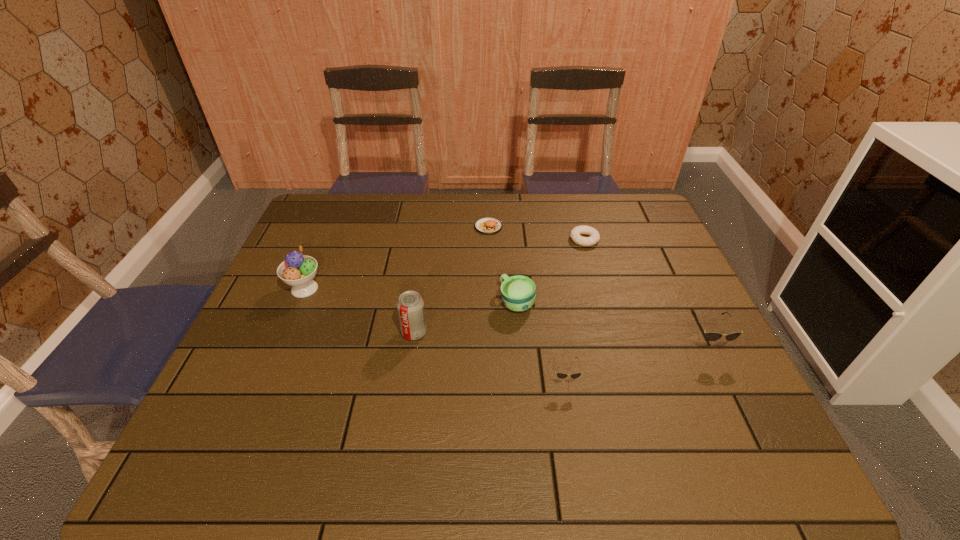
Find the location of a particular element. vacant space located 0.070m in front of the lenses of the shorter sunglasses is located at coordinates (571, 418).

You are a GUI agent. You are given a task and a screenshot of the screen. Output one action in this format:
    pyautogui.click(x=<x>, y=<y>)
    Task: Click on the free space located 0.170m in front of the lenses of the rightmost object
    The width and height of the screenshot is (960, 540).
    Given the screenshot: What is the action you would take?
    pyautogui.click(x=746, y=423)

The width and height of the screenshot is (960, 540). Identify the location of vacant space located on the front of the patty. (490, 279).

This screenshot has height=540, width=960. I want to click on vacant space located 0.070m on the left of the shortest object, so click(548, 239).

Locate an element on the screen. This screenshot has height=540, width=960. vacant space located on the back of the soda can is located at coordinates (424, 263).

This screenshot has height=540, width=960. What are the coordinates of `free space located on the back of the leftmost object` in the screenshot? It's located at (342, 203).

The image size is (960, 540). I want to click on blank space located on the right of the cup, so click(x=681, y=302).

The width and height of the screenshot is (960, 540). Identify the location of patty present at the far edge. (488, 225).

Find the location of `doughnut present at the far edge`. doughnut present at the far edge is located at coordinates (576, 232).

Locate an element on the screen. object positioned at the near edge is located at coordinates (560, 375).